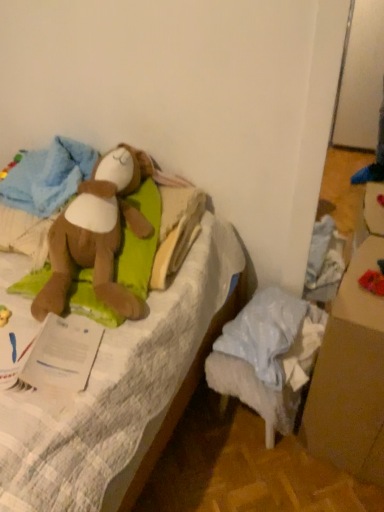
Question: Is white paper at left far away from brown cardboard box at lower right?

Choices:
 (A) yes
 (B) no

Answer: (B)

Question: Is white paper at left aimed at brown cardboard box at lower right?

Choices:
 (A) no
 (B) yes

Answer: (A)

Question: Considering the relative sizes of white paper at left and brown cardboard box at lower right in the image provided, is white paper at left bigger than brown cardboard box at lower right?

Choices:
 (A) yes
 (B) no

Answer: (B)

Question: Is brown cardboard box at lower right completely or partially inside white paper at left?

Choices:
 (A) yes
 (B) no

Answer: (B)

Question: Are white paper at left and brown cardboard box at lower right beside each other?

Choices:
 (A) no
 (B) yes

Answer: (A)

Question: From a real-world perspective, relative to brown plush toy at upper left, is brown cardboard box at lower right vertically above or below?

Choices:
 (A) below
 (B) above

Answer: (A)

Question: Based on their positions, is brown cardboard box at lower right located to the left or right of brown plush toy at upper left?

Choices:
 (A) left
 (B) right

Answer: (B)

Question: Choose the correct answer: Is brown cardboard box at lower right inside brown plush toy at upper left or outside it?

Choices:
 (A) inside
 (B) outside

Answer: (B)

Question: Is brown cardboard box at lower right taller or shorter than brown plush toy at upper left?

Choices:
 (A) tall
 (B) short

Answer: (B)

Question: From a real-world perspective, relative to brown plush toy at left, acting as the first toy starting from the left, is red fabric toy at lower right, arranged as the second toy when viewed from the left, vertically above or below?

Choices:
 (A) above
 (B) below

Answer: (A)

Question: From the image's perspective, relative to brown plush toy at left, which is counted as the second toy, starting from the right, is red fabric toy at lower right, the first toy in the right-to-left sequence, above or below?

Choices:
 (A) above
 (B) below

Answer: (B)

Question: Is red fabric toy at lower right, arranged as the second toy when viewed from the left, bigger or smaller than brown plush toy at left, acting as the first toy starting from the left?

Choices:
 (A) big
 (B) small

Answer: (B)

Question: Considering the relative positions of red fabric toy at lower right, the first toy in the right-to-left sequence, and brown plush toy at left, which is counted as the second toy, starting from the right, in the image provided, is red fabric toy at lower right, the first toy in the right-to-left sequence, to the left or to the right of brown plush toy at left, which is counted as the second toy, starting from the right,?

Choices:
 (A) left
 (B) right

Answer: (B)

Question: From the image's perspective, relative to red fabric toy at lower right, arranged as the second toy when viewed from the left, is brown cardboard box at lower right above or below?

Choices:
 (A) below
 (B) above

Answer: (A)

Question: Considering the positions of brown cardboard box at lower right and red fabric toy at lower right, arranged as the second toy when viewed from the left, in the image, is brown cardboard box at lower right wider or thinner than red fabric toy at lower right, arranged as the second toy when viewed from the left,?

Choices:
 (A) thin
 (B) wide

Answer: (B)